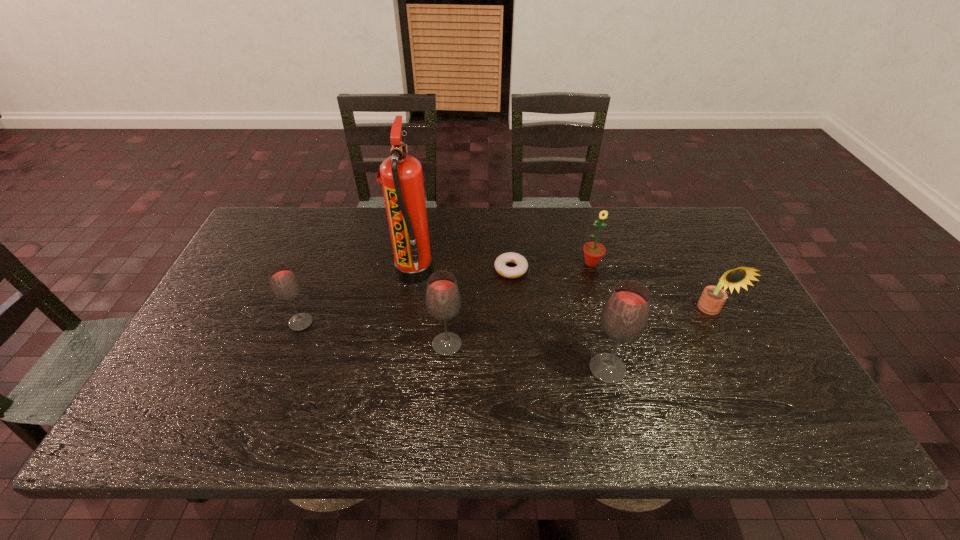
Observe the arrangement of all glass drink containers in the image. To keep them evenly spaced, where would you place another glass drink container on the right? Please locate a free space. Please provide its 2D coordinates. Your answer should be formatted as a tuple, i.e. [(x, y)], where the tuple contains the x and y coordinates of a point satisfying the conditions above.

[(784, 396)]